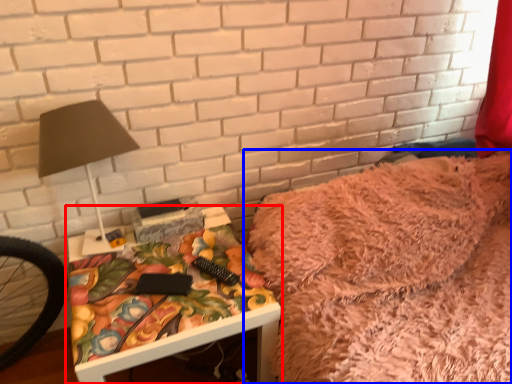
Question: Among these objects, which one is farthest to the camera, table (highlighted by a red box) or furniture (highlighted by a blue box)?

Choices:
 (A) table
 (B) furniture

Answer: (A)